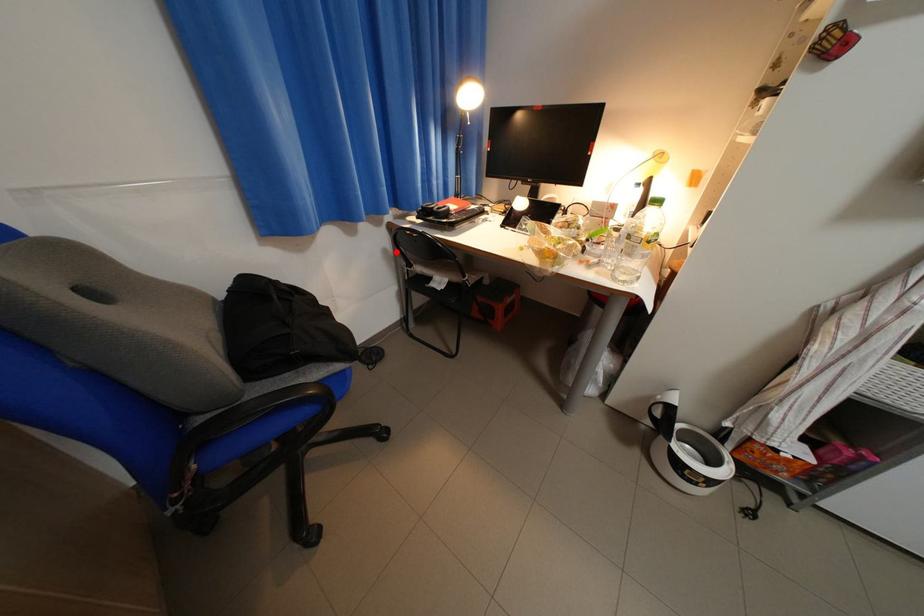
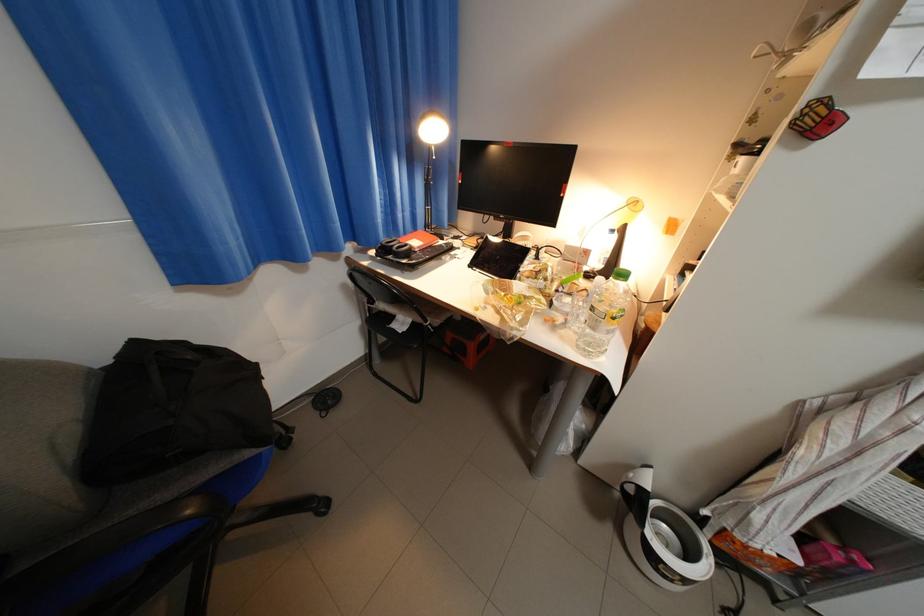
Question: I am providing you with two images of the same scene from different viewpoints. A red point is marked on the first image. At the location where the point appears in image 1, is it still visible in image 2?

Choices:
 (A) Yes
 (B) No

Answer: (A)